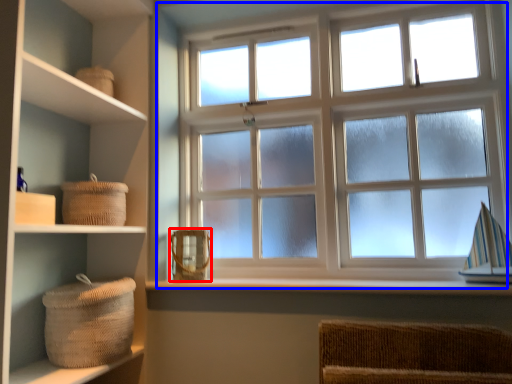
Question: Among these objects, which one is nearest to the camera, basket (highlighted by a red box) or window (highlighted by a blue box)?

Choices:
 (A) basket
 (B) window

Answer: (B)